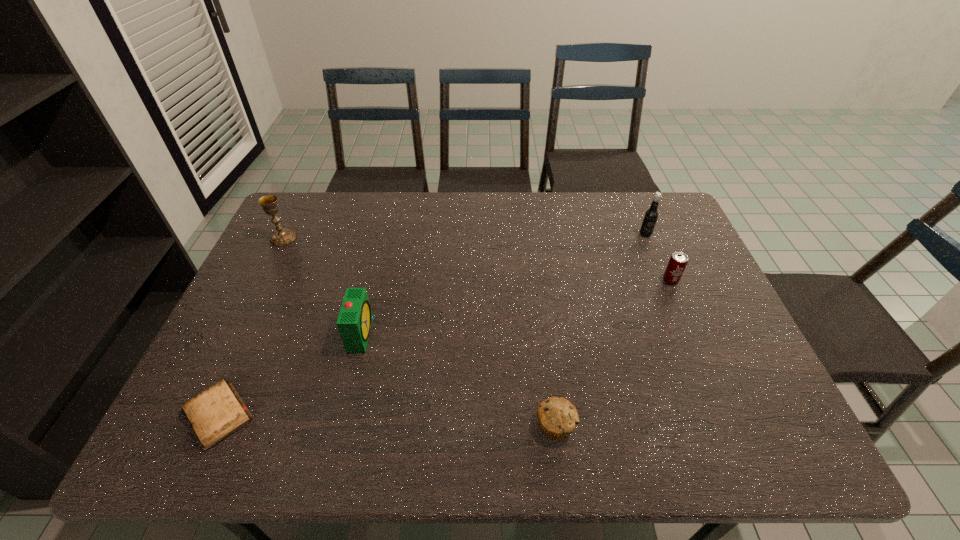
Identify the location of diary situated at the left edge. The height and width of the screenshot is (540, 960). click(218, 412).

Where is `root beer that is at the right edge`? root beer that is at the right edge is located at coordinates (651, 215).

I want to click on beer can at the right edge, so click(678, 261).

Locate an element on the screen. This screenshot has width=960, height=540. object located at the far left corner is located at coordinates (282, 236).

Locate an element on the screen. object located at the near left corner is located at coordinates (218, 412).

Identify the location of object located in the far right corner section of the desktop. Image resolution: width=960 pixels, height=540 pixels. (651, 215).

At what (x,y) coordinates should I click in order to perform the action: click on vacant area at the far edge. Please return your answer as a coordinate pair (x, y). The width and height of the screenshot is (960, 540). Looking at the image, I should click on (540, 230).

In the image, there is a desktop. At what (x,y) coordinates should I click in order to perform the action: click on free region at the near edge. Please return your answer as a coordinate pair (x, y). The image size is (960, 540). Looking at the image, I should click on (302, 423).

Where is `vacant space at the left edge of the desktop`? vacant space at the left edge of the desktop is located at coordinates (271, 290).

Identify the location of vacant space at the right edge of the desktop. (731, 366).